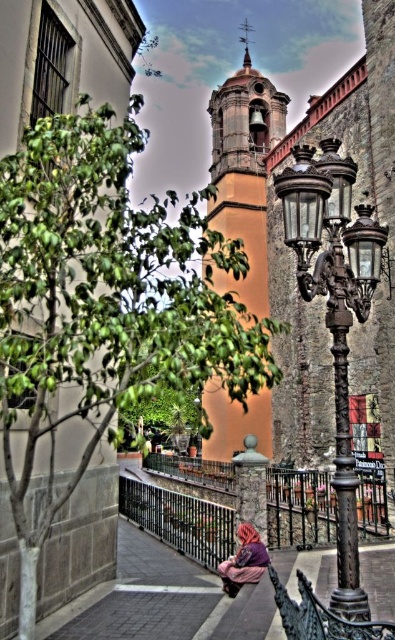
Which is below, black wrought iron railing at center or purple fabric at lower center?

black wrought iron railing at center is below.

Identify the location of black wrought iron railing at center. (299, 508).

Which of these two, green leafy tree at upper left or black wrought iron railing at center, stands taller?

Standing taller between the two is green leafy tree at upper left.

Between green leafy tree at upper left and black wrought iron railing at center, which one appears on the right side from the viewer's perspective?

From the viewer's perspective, black wrought iron railing at center appears more on the right side.

You are a GUI agent. You are given a task and a screenshot of the screen. Output one action in this format:
    pyautogui.click(x=<x>, y=<y>)
    Task: Click on the green leafy tree at upper left
    
    Given the screenshot: What is the action you would take?
    pyautogui.click(x=105, y=304)

You are a GUI agent. You are given a task and a screenshot of the screen. Output one action in this format:
    pyautogui.click(x=<x>, y=<y>)
    Task: Click on the green leafy tree at upper left
    
    Given the screenshot: What is the action you would take?
    pyautogui.click(x=105, y=304)

Is point (297, 212) farther from viewer compared to point (220, 483)?

No, (297, 212) is closer to viewer.

Is bronze textured streetlamp at center right wider than black wrought iron railing at center?

In fact, bronze textured streetlamp at center right might be narrower than black wrought iron railing at center.

Where is `bronze textured streetlamp at center right`? bronze textured streetlamp at center right is located at coordinates (336, 321).

You are a GUI agent. You are given a task and a screenshot of the screen. Output one action in this format:
    pyautogui.click(x=<x>, y=<y>)
    Task: Click on the bronze textured streetlamp at center right
    The height and width of the screenshot is (640, 395).
    Given the screenshot: What is the action you would take?
    pyautogui.click(x=336, y=321)